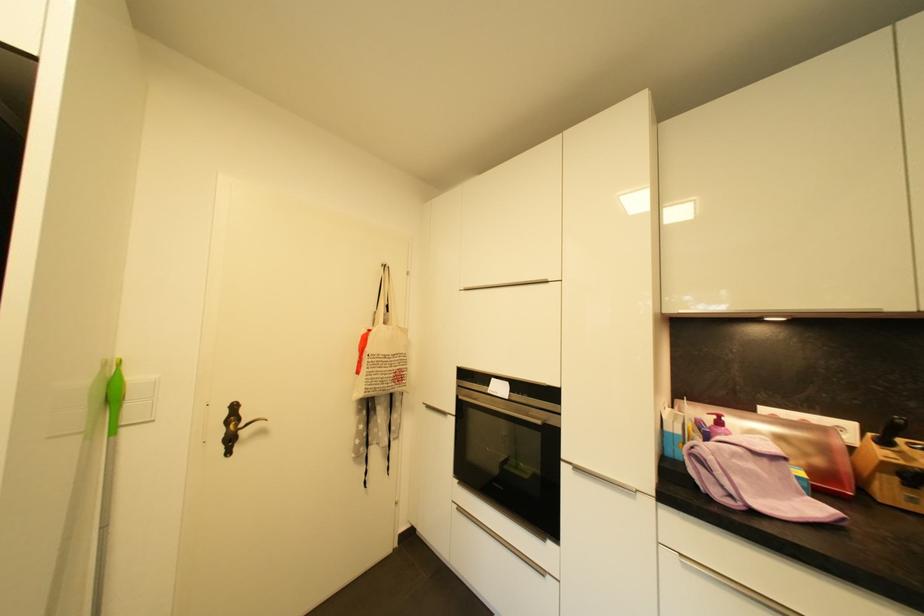
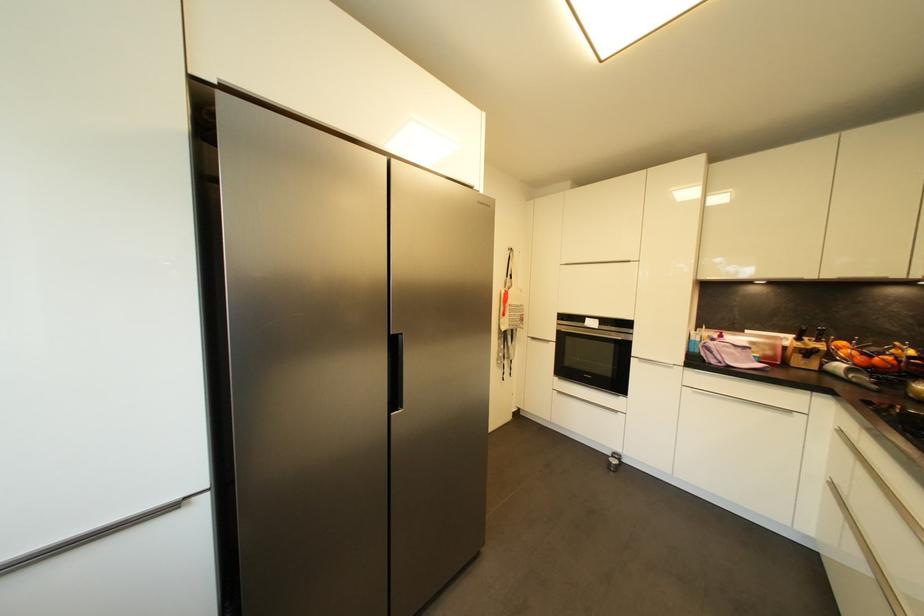
The images are taken continuously from a first-person perspective. In which direction are you moving?

The cameraman walked toward left, backward.